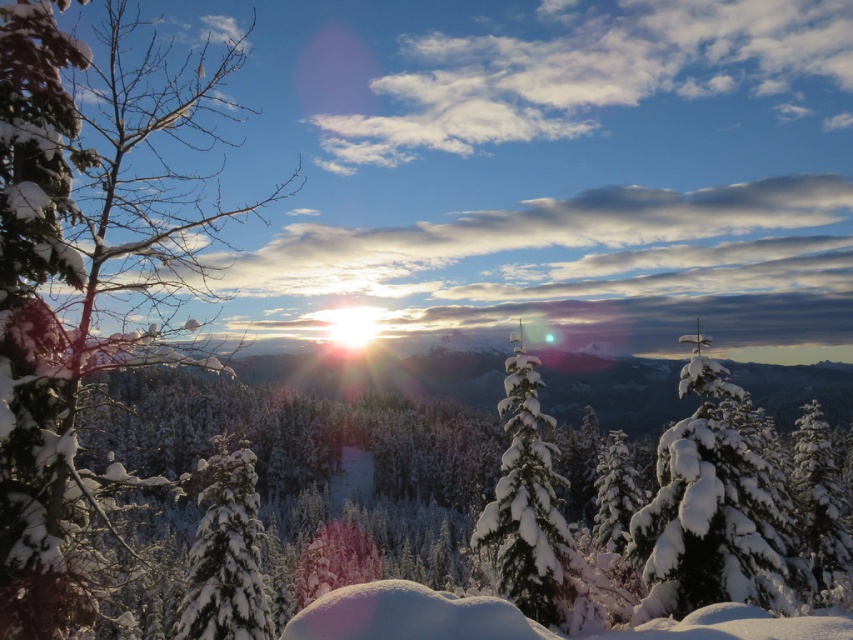
Based on the photo, does snow-covered evergreen at right have a smaller size compared to white fluffy snow-covered tree at center?

Indeed, snow-covered evergreen at right has a smaller size compared to white fluffy snow-covered tree at center.

Is snow-covered evergreen at right below white fluffy snow-covered tree at center?

No.

Is point (726, 476) closer to camera compared to point (252, 451)?

That is True.

Where is `snow-covered evergreen at right`? snow-covered evergreen at right is located at coordinates (709, 509).

Who is higher up, snow-covered branch at left or white fluffy snow-covered tree at center?

snow-covered branch at left is higher up.

From the picture: Is snow-covered branch at left bigger than white fluffy snow-covered tree at center?

Correct, snow-covered branch at left is larger in size than white fluffy snow-covered tree at center.

Is point (67, 100) behind point (210, 563)?

No, it is not.

Image resolution: width=853 pixels, height=640 pixels. I want to click on snow-covered branch at left, so click(90, 269).

Who is taller, snow-covered branch at left or snow-covered evergreen at center?

With more height is snow-covered branch at left.

You are a GUI agent. You are given a task and a screenshot of the screen. Output one action in this format:
    pyautogui.click(x=<x>, y=<y>)
    Task: Click on the snow-covered branch at left
    
    Given the screenshot: What is the action you would take?
    pyautogui.click(x=90, y=269)